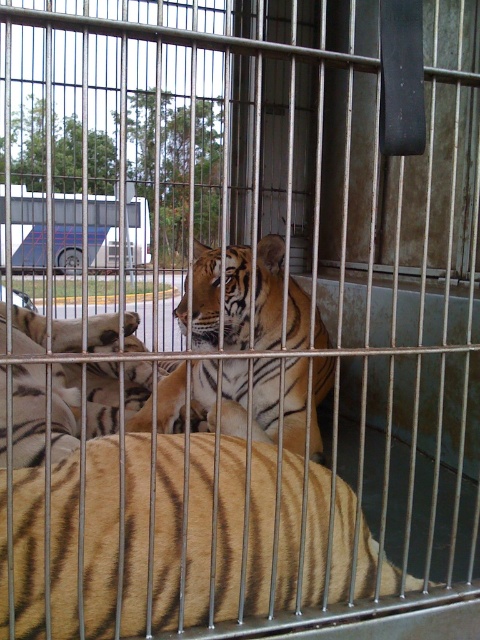
You are a zookeeper standing at the entrance of the cage. You need to place a new feeding bowl for the golden fur tiger at center. According to the coordinates provided, where should you place the bowl?

The golden fur tiger at center is located at point (x=177, y=538), so the feeding bowl should be placed near that coordinate to ensure the tiger can easily access it.